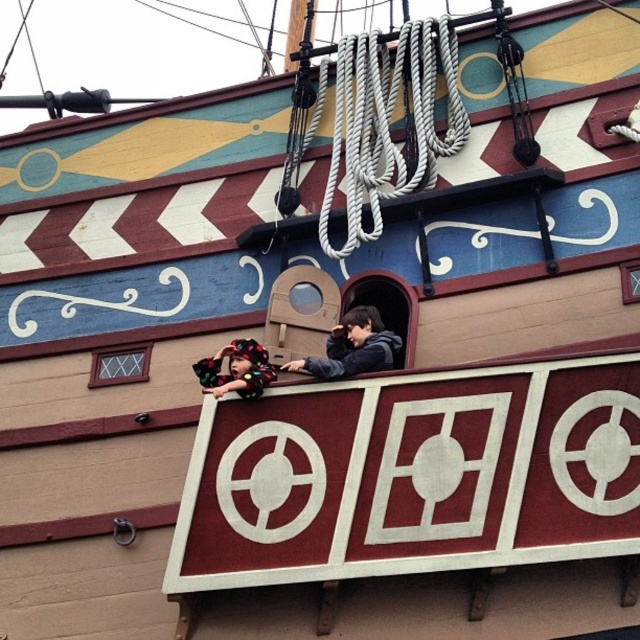
You are a guest on this pirate ship deck and want to sit down. You see the fluffy multicolored blanket at center and the fluffy hair at upper center. Which object is located to the right of the other?

The fluffy multicolored blanket at center is positioned on the right side of fluffy hair at upper center.

You are a pirate captain standing on the ship deck. You have a fluffy multicolored blanket at center and a fluffy hair at upper center. Which item is closer to you?

The fluffy multicolored blanket at center is closer to you because it is in front of the fluffy hair at upper center.

You are a guest at the pirate ship attraction and notice the dark gray hoodie at center and the fluffy hair at upper center. Which object appears taller from your viewing position?

The fluffy hair at upper center appears taller than the dark gray hoodie at center because the dark gray hoodie at center is not as tall as fluffy hair at upper center.